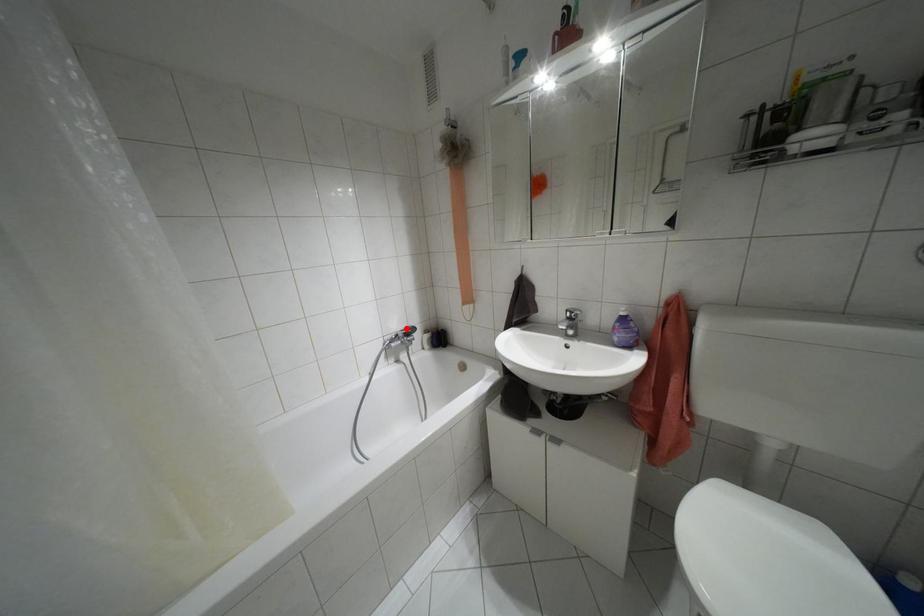
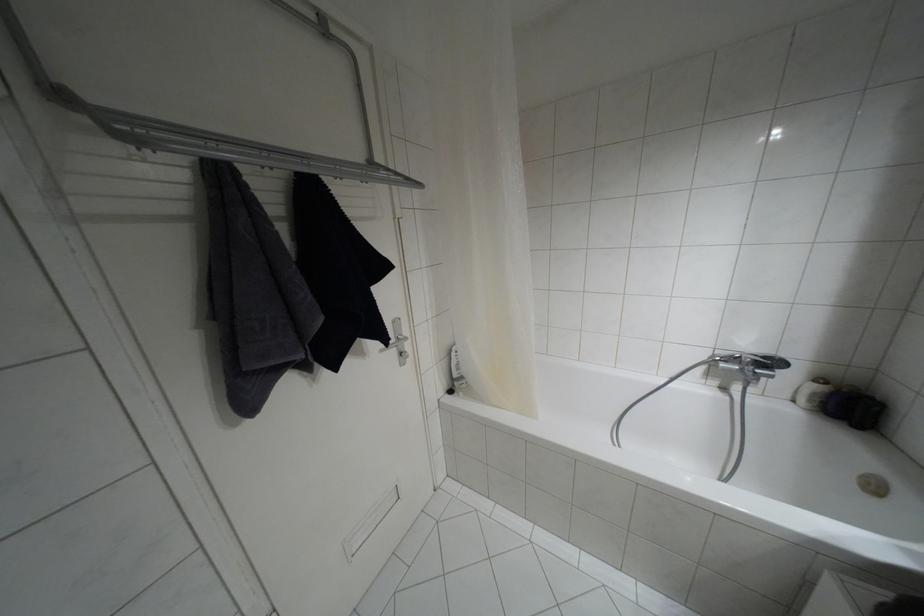
Locate, in the second image, the point that corresponds to the highlighted location in the first image.

(763, 357)